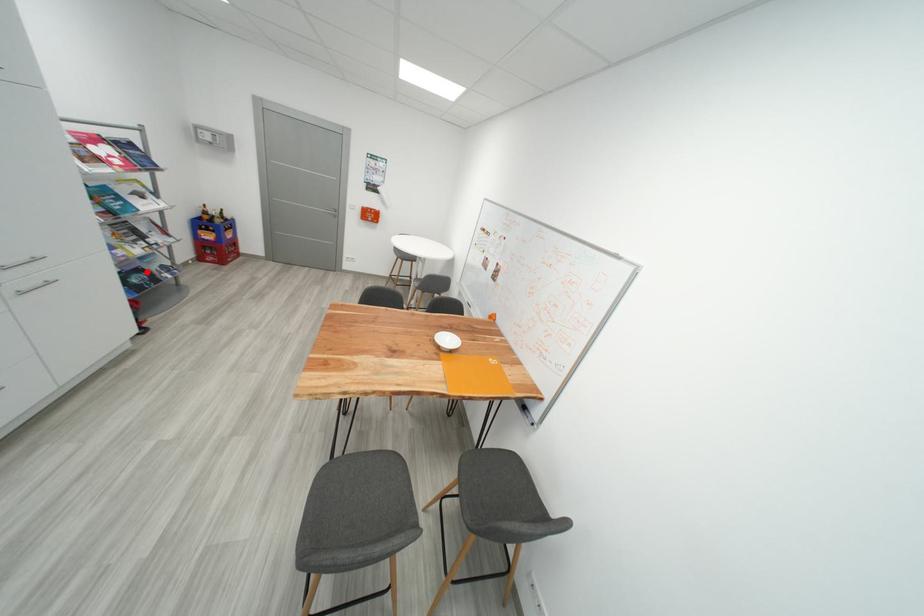
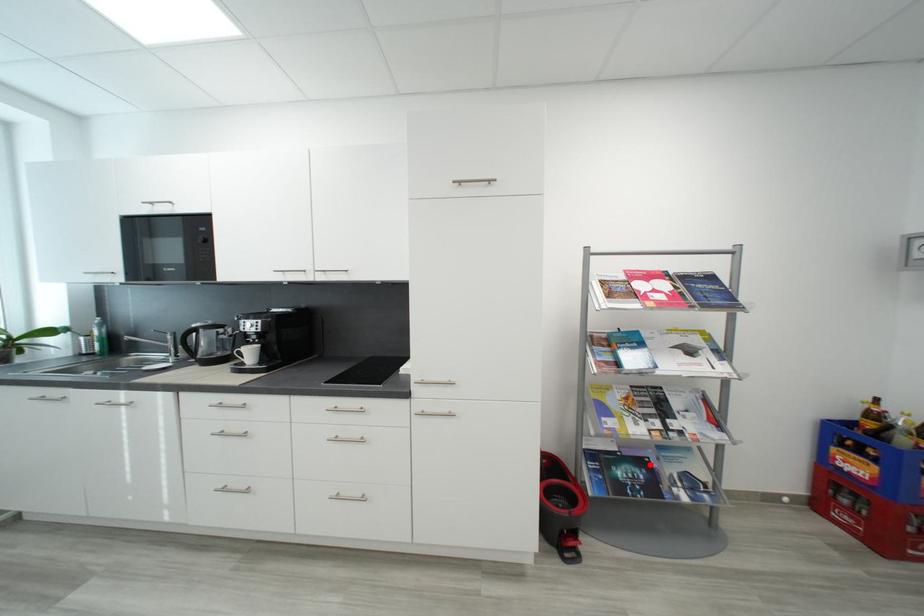
I am providing you with two images of the same scene from different viewpoints. A red point is marked on the first image and another point is marked on the second image. Is the marked point in image1 the same physical position as the marked point in image2?

Yes